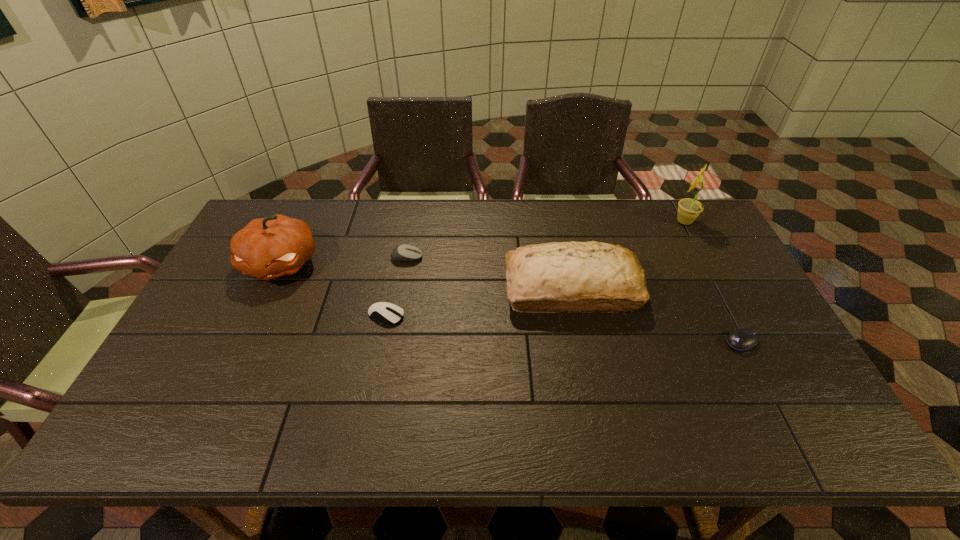
Find the location of `sunflower`. sunflower is located at coordinates (689, 209).

This screenshot has width=960, height=540. Find the location of `the farthest object`. the farthest object is located at coordinates (689, 209).

Where is `the second tallest object`? the second tallest object is located at coordinates (267, 248).

Where is `the leftmost object`? the leftmost object is located at coordinates (267, 248).

Where is `the third tallest object`? This screenshot has height=540, width=960. the third tallest object is located at coordinates (574, 277).

Where is `the fourth object from left to right`? the fourth object from left to right is located at coordinates (574, 277).

The width and height of the screenshot is (960, 540). I want to click on the farthest computer mouse, so click(x=402, y=253).

This screenshot has width=960, height=540. What are the coordinates of `the second farthest computer mouse` in the screenshot? It's located at (389, 313).

Image resolution: width=960 pixels, height=540 pixels. I want to click on the shortest computer mouse, so click(742, 339).

You are a GUI agent. You are given a task and a screenshot of the screen. Output one action in this format:
    pyautogui.click(x=<x>, y=<y>)
    Task: Click on the nearest computer mouse
    The height and width of the screenshot is (540, 960).
    Given the screenshot: What is the action you would take?
    pyautogui.click(x=742, y=339)